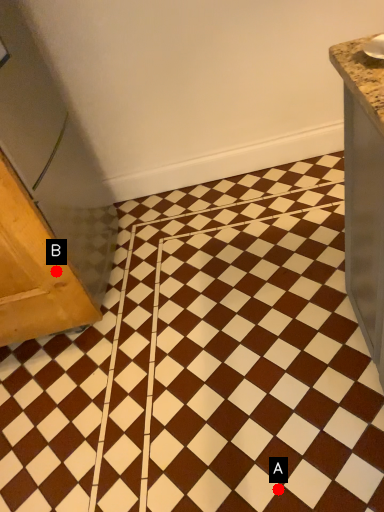
Question: Two points are circled on the image, labeled by A and B beside each circle. Which point is further to the camera?

Choices:
 (A) A is further
 (B) B is further

Answer: (B)